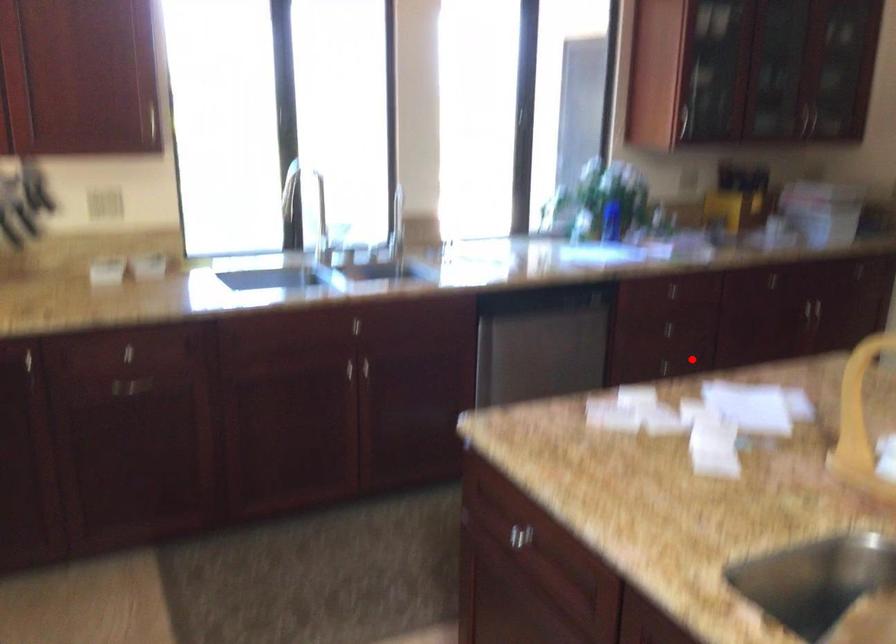
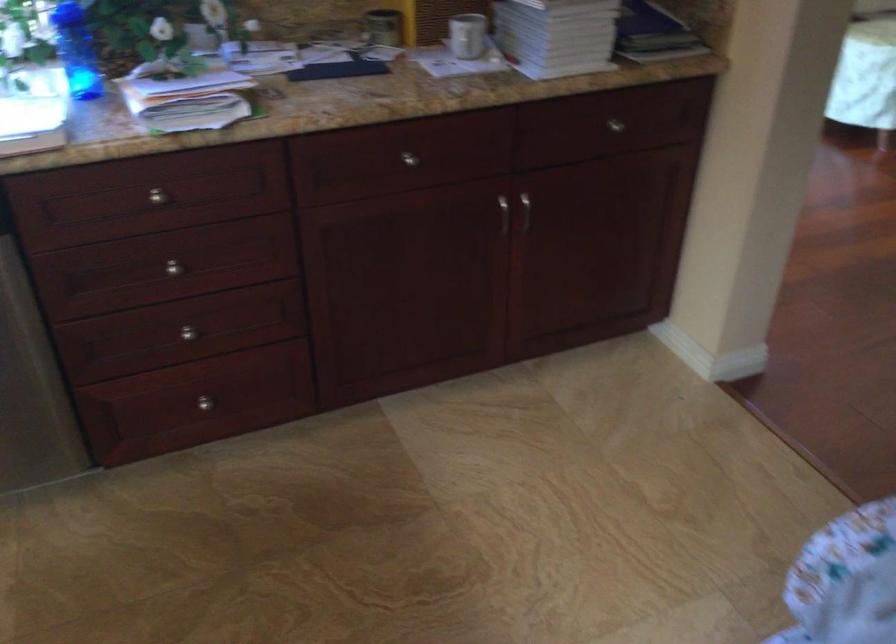
Where in the second image is the point corresponding to the highlighted location from the first image?

(188, 333)